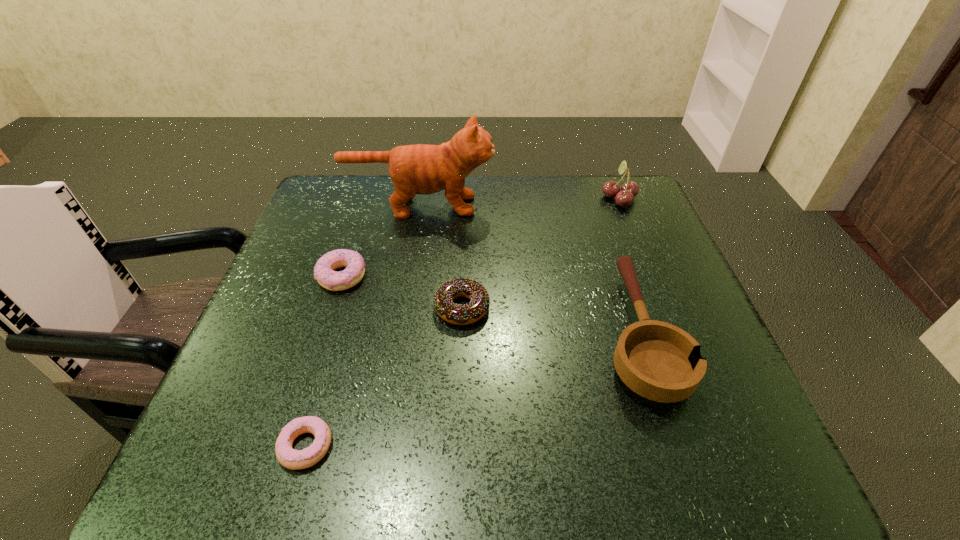
Identify the location of cat. The width and height of the screenshot is (960, 540). (424, 169).

You are a GUI agent. You are given a task and a screenshot of the screen. Output one action in this format:
    pyautogui.click(x=<x>, y=<y>)
    Task: Click on the second tallest object
    
    Given the screenshot: What is the action you would take?
    pyautogui.click(x=624, y=197)

This screenshot has width=960, height=540. Find the location of `saucepan`. saucepan is located at coordinates [x=659, y=361].

The image size is (960, 540). I want to click on the rightmost doughnut, so click(x=469, y=313).

Where is `the shortest doughnut`? Image resolution: width=960 pixels, height=540 pixels. the shortest doughnut is located at coordinates (288, 457).

Find the location of `the shortest object`. the shortest object is located at coordinates (288, 457).

This screenshot has height=540, width=960. Find the location of `vacant position located 0.370m on the face of the tallest object`. vacant position located 0.370m on the face of the tallest object is located at coordinates (630, 206).

Locate an element on the screen. The width and height of the screenshot is (960, 540). free space located 0.390m on the leaves of the cherry is located at coordinates (461, 198).

The image size is (960, 540). Identify the location of vacant space situated 0.380m on the leaves of the cherry. (465, 198).

I want to click on vacant space located 0.060m on the leaves of the cherry, so click(580, 198).